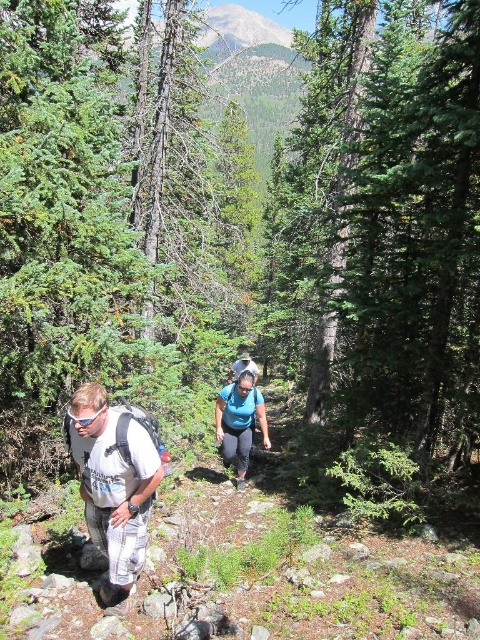
Question: Does white mesh backpack at lower left appear on the left side of white cotton t-shirt at lower left?

Choices:
 (A) no
 (B) yes

Answer: (A)

Question: Can you confirm if white mesh backpack at lower left is thinner than white cotton t-shirt at lower left?

Choices:
 (A) yes
 (B) no

Answer: (B)

Question: Which of the following is the closest to the observer?

Choices:
 (A) blue fabric shirt at center
 (B) matte black goggles at lower left
 (C) white cotton t-shirt at lower left

Answer: (B)

Question: Which of the following is the farthest from the observer?

Choices:
 (A) white mesh backpack at lower left
 (B) blue fabric shirt at center

Answer: (B)

Question: Based on their relative distances, which object is farther from the white cotton t-shirt at lower left?

Choices:
 (A) matte black goggles at lower left
 (B) white mesh backpack at lower left
 (C) blue fabric shirt at center

Answer: (C)

Question: Is white mesh backpack at lower left to the left of white cotton t-shirt at lower left from the viewer's perspective?

Choices:
 (A) yes
 (B) no

Answer: (B)